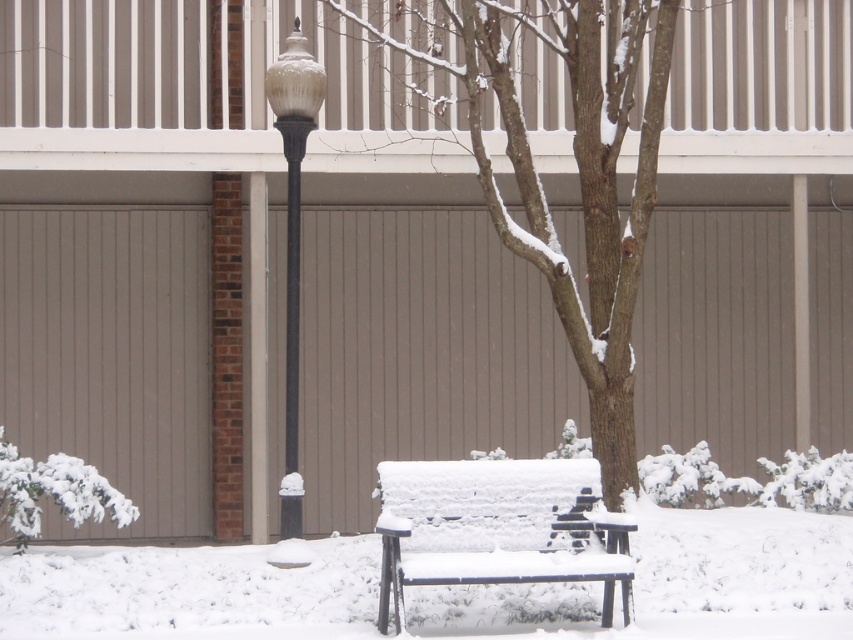
You are a window cleaner with a 3.5 meter ladder. You need to clean the white textured balcony at upper center and the matte gray garage door at left. Which object can you reach with your ladder?

The white textured balcony at upper center is shorter than the matte gray garage door at left, so the ladder can reach the white textured balcony at upper center but may not reach the matte gray garage door at left.

You are standing in the winter scene depicted in the image. You notice a point at coordinates (194, 90). What object is located at that point?

The white textured balcony at upper center is located at point (194, 90).